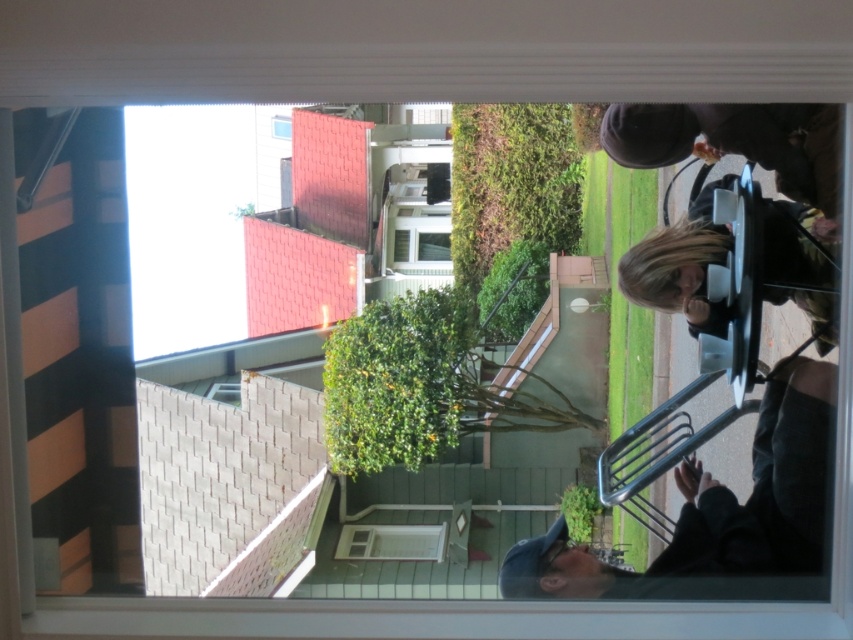
Is point (792, 563) closer to viewer compared to point (279, 115)?

Yes, it is in front of point (279, 115).

Can you confirm if dark gray fabric jacket at lower right is positioned below matte glass window at upper center?

Correct, dark gray fabric jacket at lower right is located below matte glass window at upper center.

Who is more forward, (798, 548) or (283, 115)?

Point (798, 548) is more forward.

The width and height of the screenshot is (853, 640). I want to click on dark gray fabric jacket at lower right, so click(x=718, y=508).

Does dark gray fabric jacket at lower right appear over blonde hair at lower right?

No.

Can you confirm if dark gray fabric jacket at lower right is positioned to the left of blonde hair at lower right?

Yes, dark gray fabric jacket at lower right is to the left of blonde hair at lower right.

Is point (816, 502) positioned in front of point (825, 332)?

That is True.

Identify the location of dark gray fabric jacket at lower right. (718, 508).

Who is lower down, blonde hair at lower right or matte glass window at upper center?

blonde hair at lower right

Is blonde hair at lower right closer to camera compared to matte glass window at upper center?

Yes, it is in front of matte glass window at upper center.

Is point (825, 321) farther from camera compared to point (283, 134)?

No, it is in front of (283, 134).

I want to click on blonde hair at lower right, so click(680, 262).